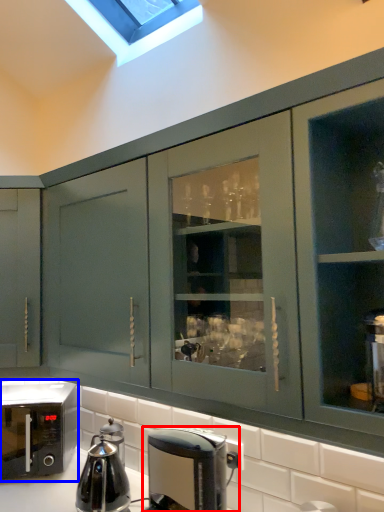
Question: Which point is further to the camera, coffee maker (highlighted by a red box) or home appliance (highlighted by a blue box)?

Choices:
 (A) coffee maker
 (B) home appliance

Answer: (B)